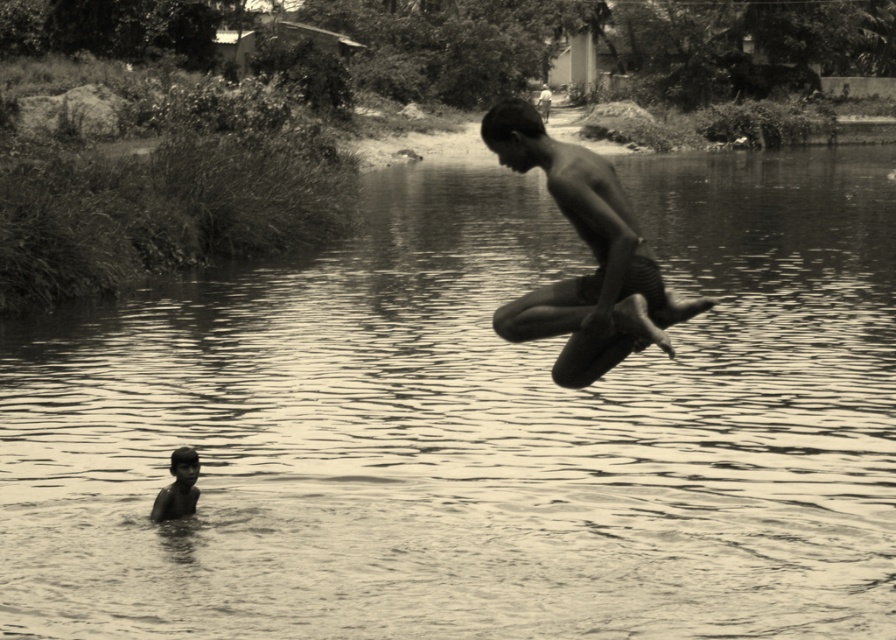
Based on the photo, which of these two, smooth skin man at center or smooth skin child at lower left, stands taller?

smooth skin man at center is taller.

Between smooth skin man at center and smooth skin child at lower left, which one has less height?

smooth skin child at lower left is shorter.

Does point (679, 316) lie in front of point (188, 476)?

That is True.

The image size is (896, 640). I want to click on smooth skin man at center, so click(592, 253).